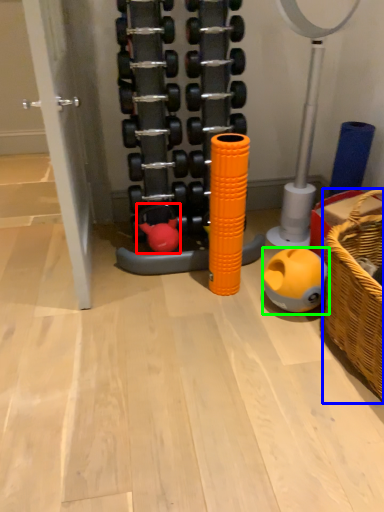
Question: Which is nearer to the toy (highlighted by a red box)? basket (highlighted by a blue box) or toy (highlighted by a green box).

Choices:
 (A) basket
 (B) toy

Answer: (B)